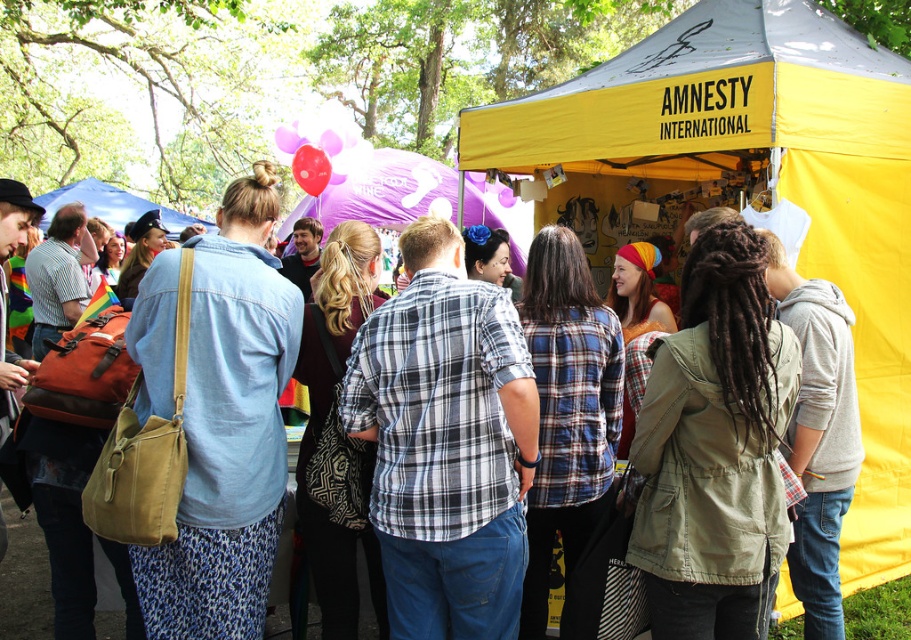
Question: Which point is closer to the camera?

Choices:
 (A) (74, 188)
 (B) (875, 122)
 (C) (322, 186)
 (D) (278, 154)

Answer: (B)

Question: Which object is the closest to the rubber balloon at upper center?

Choices:
 (A) purple fabric tent at center
 (B) rubberized glossy balloon at center
 (C) yellow fabric tent at center

Answer: (B)

Question: Is yellow fabric tent at center further to the viewer compared to rubber balloon at upper center?

Choices:
 (A) no
 (B) yes

Answer: (A)

Question: Is yellow fabric tent at center smaller than purple fabric tent at center?

Choices:
 (A) yes
 (B) no

Answer: (B)

Question: Which of the following is the farthest from the observer?

Choices:
 (A) yellow fabric tent at center
 (B) rubber balloon at upper center
 (C) matte blue tent at upper left

Answer: (C)

Question: Is matte blue shirt at center bigger than rubberized glossy balloon at center?

Choices:
 (A) yes
 (B) no

Answer: (A)